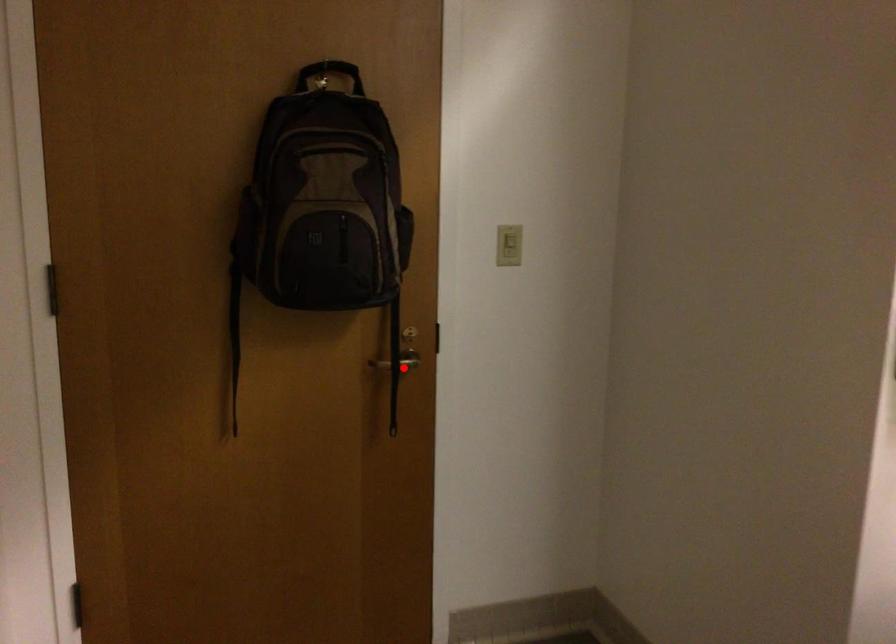
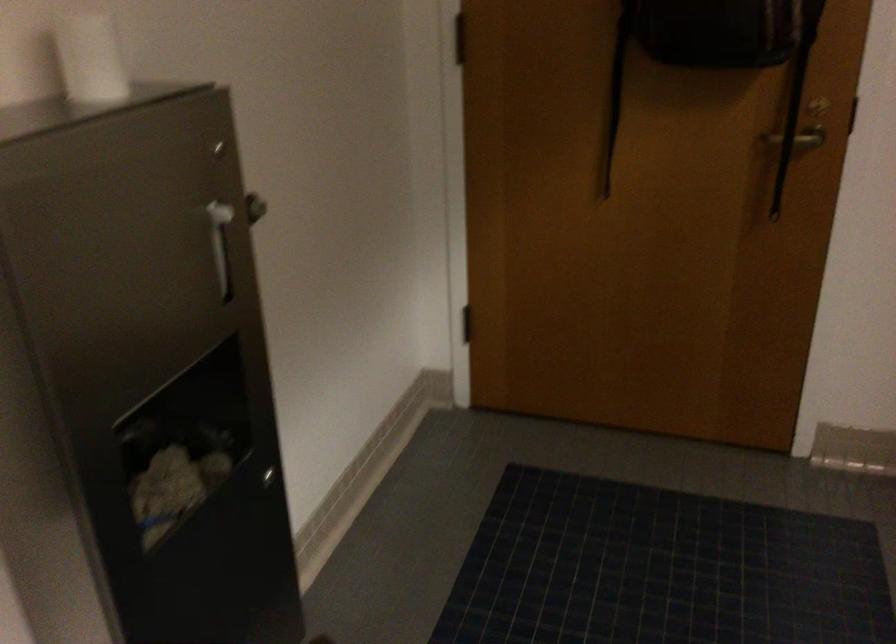
Question: I am providing you with two images of the same scene from different viewpoints. Image1 has a red point marked. In image2, the corresponding 3D location appears at what relative position? Reply with the corresponding letter.

Choices:
 (A) Closer
 (B) Farther

Answer: (A)